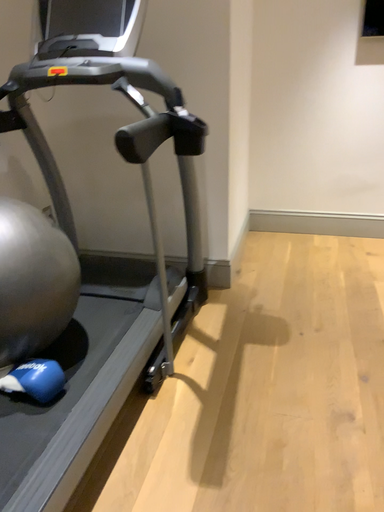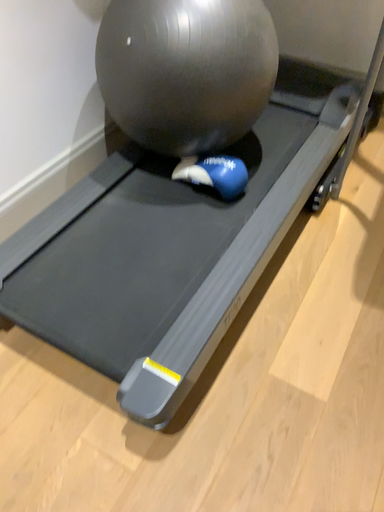
Question: Which way did the camera rotate in the video?

Choices:
 (A) rotated upward
 (B) rotated downward

Answer: (B)